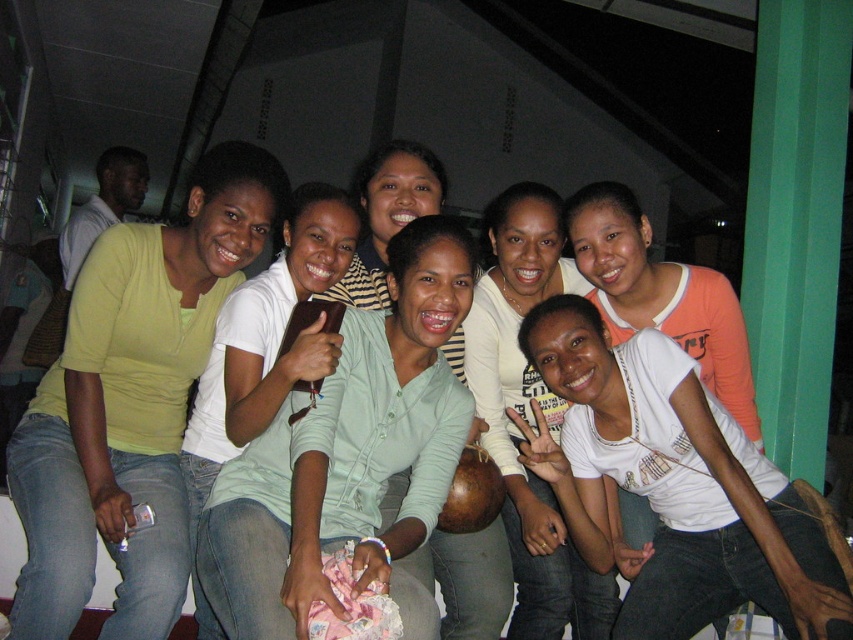
Does matte yellow shirt at left appear over matte green shirt at center?

Yes.

Is matte yellow shirt at left below matte green shirt at center?

Actually, matte yellow shirt at left is above matte green shirt at center.

Where is `matte yellow shirt at left`? The width and height of the screenshot is (853, 640). matte yellow shirt at left is located at coordinates (131, 403).

Can you confirm if white matte shirt at center is wider than white cotton shirt at center?

No, white matte shirt at center is not wider than white cotton shirt at center.

Who is shorter, white matte shirt at center or white cotton shirt at center?

Standing shorter between the two is white cotton shirt at center.

Between point (482, 292) and point (577, 237), which one is positioned in front?

Positioned in front is point (577, 237).

Identify the location of white matte shirt at center. (529, 416).

Does matte yellow shirt at left appear over white cotton shirt at center?

No, matte yellow shirt at left is not above white cotton shirt at center.

Is point (88, 401) farther from camera compared to point (590, 182)?

No, (88, 401) is closer to viewer.

You are a GUI agent. You are given a task and a screenshot of the screen. Output one action in this format:
    pyautogui.click(x=<x>, y=<y>)
    Task: Click on the matte yellow shirt at left
    This screenshot has height=640, width=853.
    Given the screenshot: What is the action you would take?
    pyautogui.click(x=131, y=403)